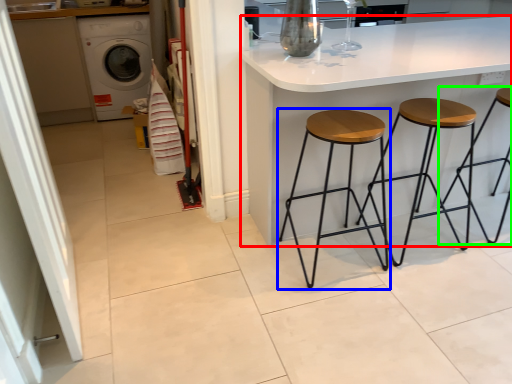
Question: Based on their relative distances, which object is nearer to table (highlighted by a red box)? Choose from stool (highlighted by a blue box) and stool (highlighted by a green box).

Choices:
 (A) stool
 (B) stool

Answer: (A)